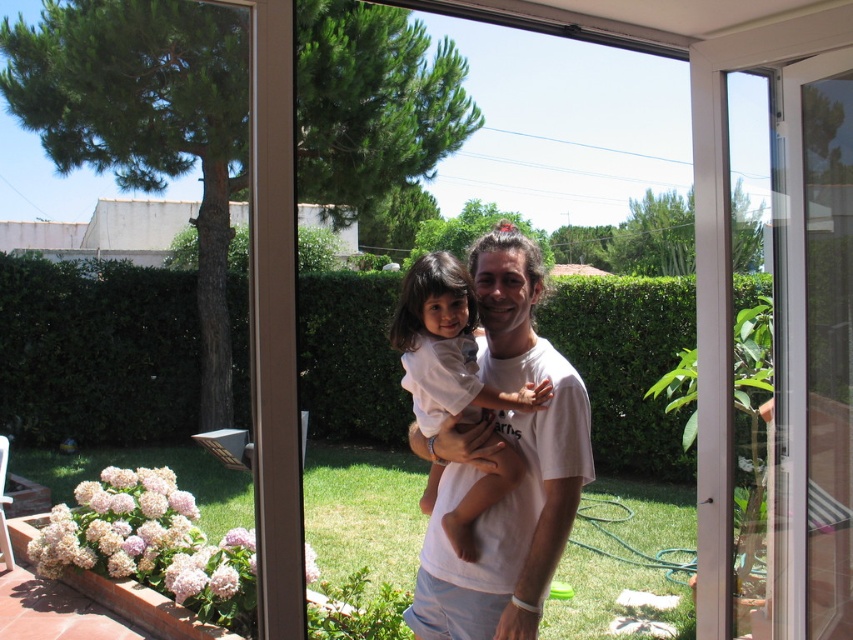
You are a delivery person holding a package that requires a 2 meter clearance to pass through doors. You approach the transparent glass door at center. Can you pass through it without tilting the package?

The transparent glass door at center is 1.93 meters away from the camera, which is slightly less than the required 2 meter clearance. Therefore, you cannot pass through it without tilting the package.

You are a delivery person holding a large package that is 3 meters long. You need to enter through either the white plastic screen door at right or the transparent glass door at center. Which door should you choose to ensure the package can fit through without being too long?

The package is 3 meters long, and the distance between the white plastic screen door at right and transparent glass door at center is 2.89 meters. Therefore, neither door can accommodate the package as it is longer than the space between them. You may need to find an alternative entrance or repackage the item.

You are standing in front of the glass door and want to exit to the garden. Which object do you need to open to leave? Please choose between the white plastic screen door at right and the hydrangea flower bed to the left.

To exit to the garden, you need to open the white plastic screen door at right, as hydrangea flower bed to the left is part of the garden scenery and cannot be opened.